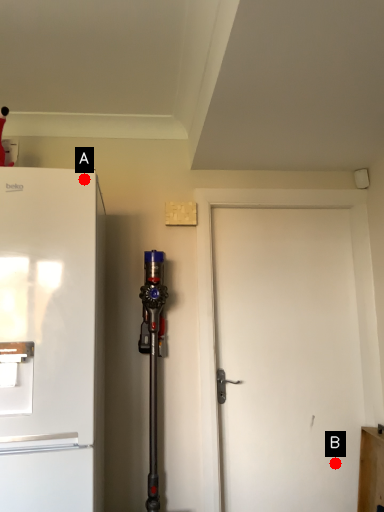
Question: Two points are circled on the image, labeled by A and B beside each circle. Which point is closer to the camera taking this photo?

Choices:
 (A) A is closer
 (B) B is closer

Answer: (A)